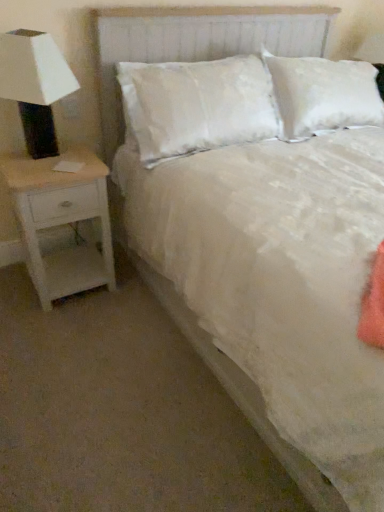
Question: Can you confirm if white matte lamp at left is positioned to the left of white wood nightstand at left?

Choices:
 (A) yes
 (B) no

Answer: (A)

Question: From the image's perspective, is white matte lamp at left on top of white wood nightstand at left?

Choices:
 (A) no
 (B) yes

Answer: (B)

Question: Are white matte lamp at left and white wood nightstand at left beside each other?

Choices:
 (A) no
 (B) yes

Answer: (A)

Question: Is white matte lamp at left not within white wood nightstand at left?

Choices:
 (A) yes
 (B) no

Answer: (A)

Question: Is white wood nightstand at left at the back of white matte lamp at left?

Choices:
 (A) yes
 (B) no

Answer: (B)

Question: Does white matte lamp at left have a greater height compared to white wood nightstand at left?

Choices:
 (A) no
 (B) yes

Answer: (A)

Question: From a real-world perspective, is white wood nightstand at left on white matte lamp at left?

Choices:
 (A) no
 (B) yes

Answer: (A)

Question: Can you confirm if white wood nightstand at left is bigger than white matte lamp at left?

Choices:
 (A) no
 (B) yes

Answer: (B)

Question: Can you confirm if white wood nightstand at left is thinner than white matte lamp at left?

Choices:
 (A) yes
 (B) no

Answer: (B)

Question: From the image's perspective, is white wood nightstand at left over white matte lamp at left?

Choices:
 (A) yes
 (B) no

Answer: (B)

Question: Considering the relative sizes of white wood nightstand at left and white matte lamp at left in the image provided, is white wood nightstand at left wider than white matte lamp at left?

Choices:
 (A) yes
 (B) no

Answer: (A)

Question: Is white wood nightstand at left completely or partially outside of white matte lamp at left?

Choices:
 (A) yes
 (B) no

Answer: (A)

Question: Does white matte lamp at left turn towards white textured headboard at center?

Choices:
 (A) yes
 (B) no

Answer: (B)